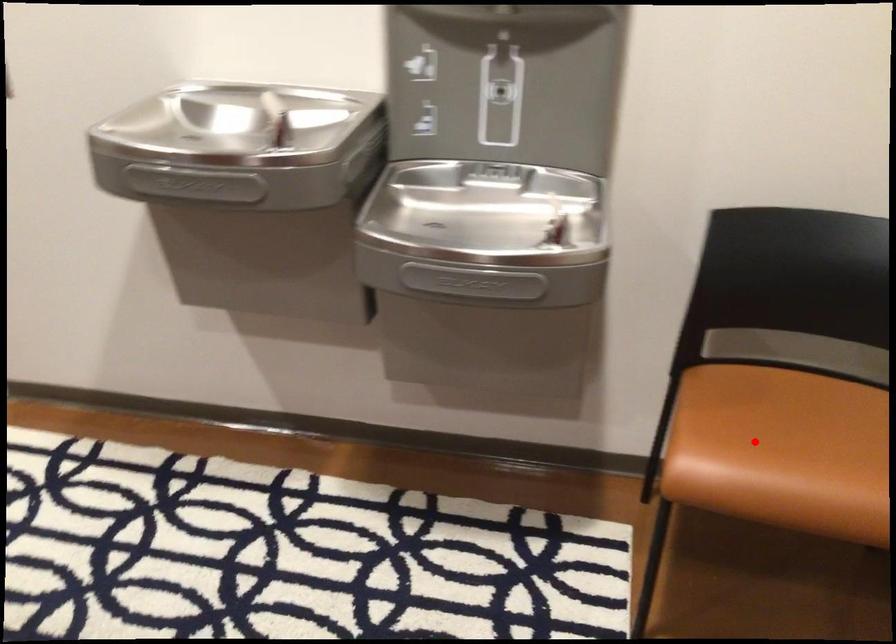
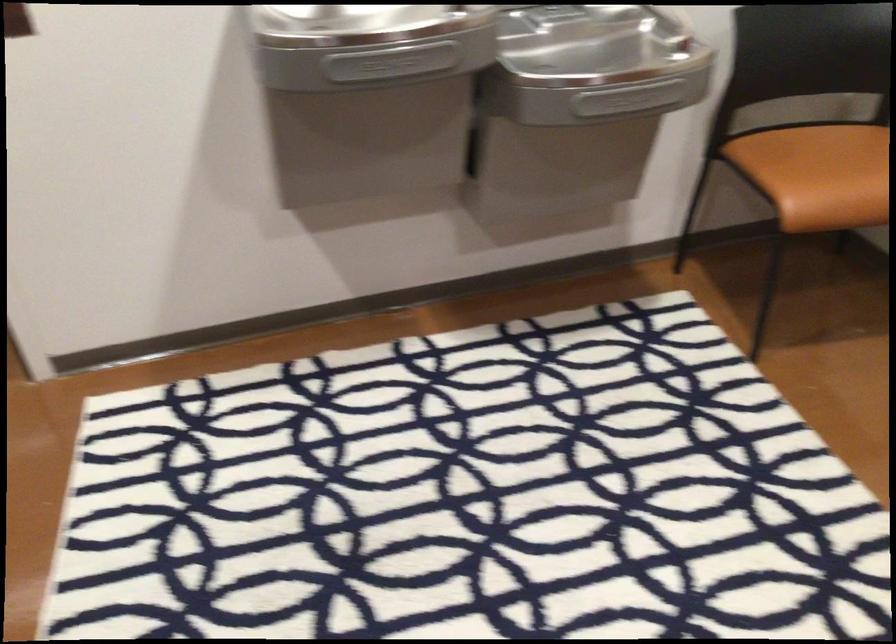
Question: I am providing you with two images of the same scene from different viewpoints. A red point is shown in image1. For the corresponding object point in image2, is it positioned nearer or farther from the camera?

Choices:
 (A) Nearer
 (B) Farther

Answer: (B)